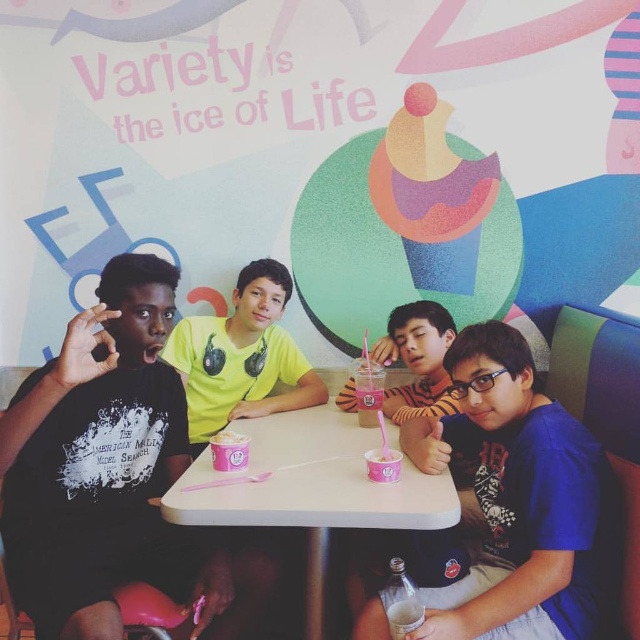
Question: Among these points, which one is nearest to the camera?

Choices:
 (A) [177, 326]
 (B) [362, 426]
 (C) [444, 336]
 (D) [536, 396]

Answer: (D)

Question: Which point is farther to the camera?

Choices:
 (A) click(x=544, y=417)
 (B) click(x=417, y=604)
 (C) click(x=289, y=435)

Answer: (C)

Question: Which point appears farthest from the camera in this image?

Choices:
 (A) (282, 355)
 (B) (500, 506)
 (C) (360, 390)

Answer: (A)

Question: Is white plastic table at center smaller than striped sweater at center?

Choices:
 (A) no
 (B) yes

Answer: (A)

Question: Considering the relative positions of blue matte shirt at center and yellow matte shirt at center in the image provided, where is blue matte shirt at center located with respect to yellow matte shirt at center?

Choices:
 (A) below
 (B) above

Answer: (A)

Question: Can you confirm if blue matte shirt at center is positioned above pink plastic cup at center?

Choices:
 (A) no
 (B) yes

Answer: (A)